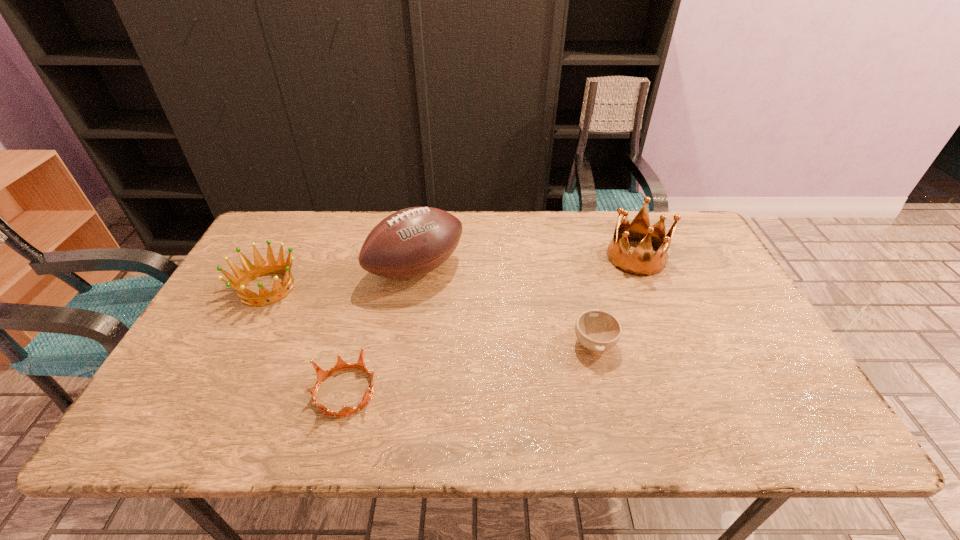
You are a GUI agent. You are given a task and a screenshot of the screen. Output one action in this format:
    pyautogui.click(x=<x>, y=<y>)
    Task: Click on the free region at the near edge of the desktop
    
    Given the screenshot: What is the action you would take?
    pyautogui.click(x=395, y=425)

The image size is (960, 540). In order to click on vacant space at the right edge of the desktop in this screenshot , I will do `click(681, 294)`.

Locate an element on the screen. The height and width of the screenshot is (540, 960). vacant point at the far left corner is located at coordinates (272, 220).

This screenshot has height=540, width=960. In order to click on vacant space at the far right corner of the desktop in this screenshot , I will do `click(689, 234)`.

Identify the location of free space between the leftmost object and the tallest crown. The image size is (960, 540). (451, 273).

What are the coordinates of `free spot between the second crown from right to left and the second shortest crown` in the screenshot? It's located at (306, 340).

Identify the location of unoccupied position between the rightmost object and the tallest object. The image size is (960, 540). (526, 264).

You are a GUI agent. You are given a task and a screenshot of the screen. Output one action in this format:
    pyautogui.click(x=<x>, y=<y>)
    Task: Click on the vacant space that is in between the football (American) and the fourth object from left to right
    
    Given the screenshot: What is the action you would take?
    pyautogui.click(x=505, y=307)

Where is `free point between the second tallest object and the leftmost object`? free point between the second tallest object and the leftmost object is located at coordinates (451, 273).

Where is `vacant area that lies between the fourth object from left to right and the second shortest crown`? vacant area that lies between the fourth object from left to right and the second shortest crown is located at coordinates (431, 315).